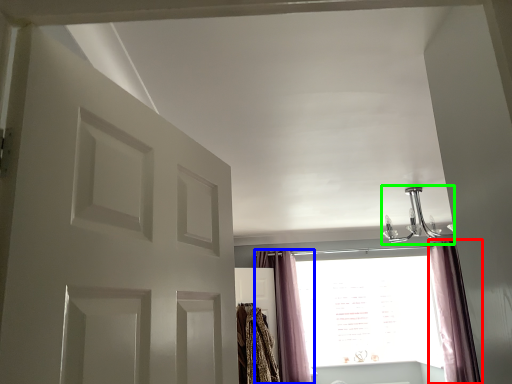
Question: Estimate the real-world distances between objects in this image. Which object is farther from curtain (highlighted by a red box), curtain (highlighted by a blue box) or light fixture (highlighted by a green box)?

Choices:
 (A) curtain
 (B) light fixture

Answer: (A)